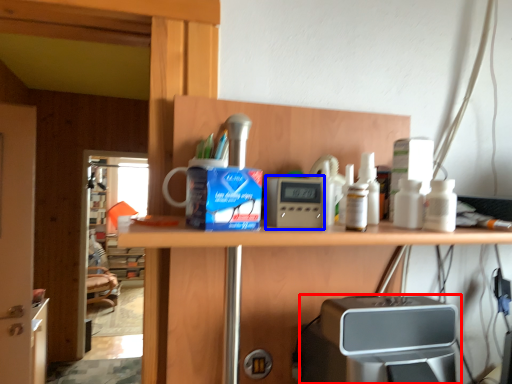
Question: Which of the following is the farthest to the observer, home appliance (highlighted by a red box) or appliance (highlighted by a blue box)?

Choices:
 (A) home appliance
 (B) appliance

Answer: (B)